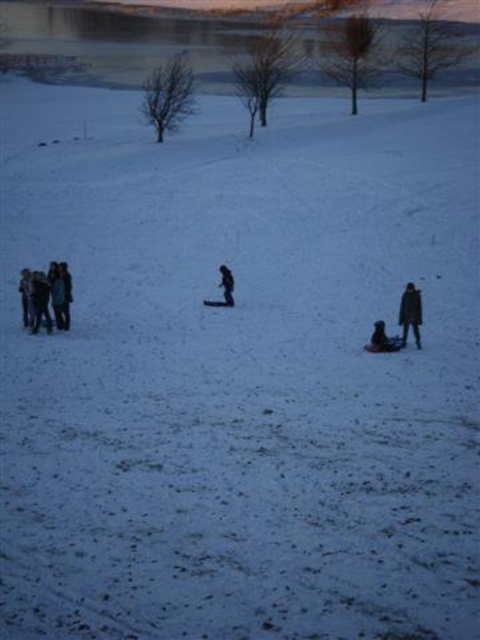
Question: From the image, what is the correct spatial relationship of dark gray jacket at lower right in relation to black matte jacket at center?

Choices:
 (A) left
 (B) right

Answer: (B)

Question: Based on their relative distances, which object is farther from the brown wool coat at right?

Choices:
 (A) dark gray jacket at lower right
 (B) dark blue jeans at left
 (C) black matte jacket at center

Answer: (B)

Question: Which point is closer to the camera taking this photo?

Choices:
 (A) (41, 289)
 (B) (384, 326)

Answer: (B)

Question: Which point is farther from the camera taking this photo?

Choices:
 (A) (382, 324)
 (B) (231, 298)
 (C) (56, 300)

Answer: (B)

Question: Does dark blue jeans at left appear under black matte jacket at center?

Choices:
 (A) no
 (B) yes

Answer: (B)

Question: In this image, where is dark blue jeans at left located relative to brown wool coat at right?

Choices:
 (A) above
 (B) below

Answer: (A)